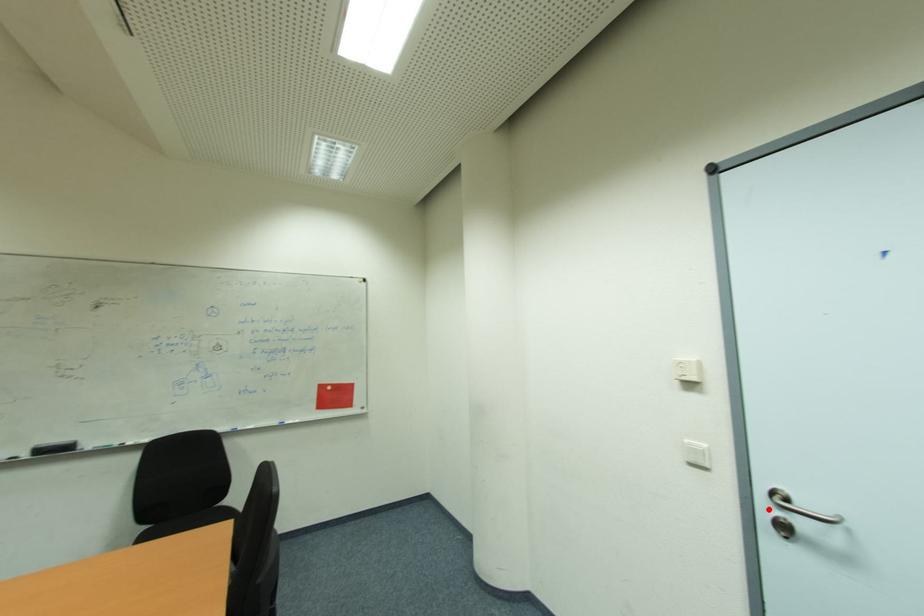
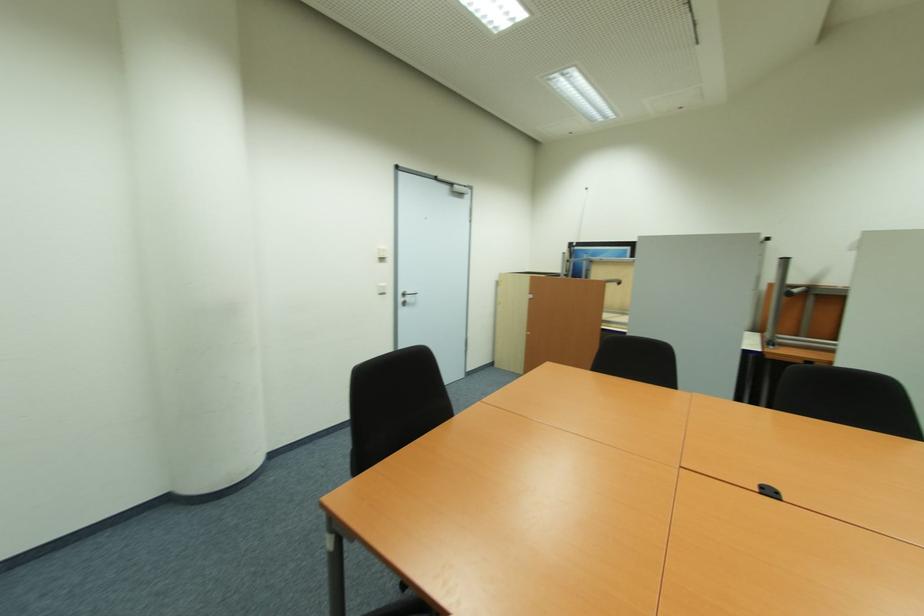
Find the pixel in the second image that matches the highlighted location in the first image.

(405, 300)